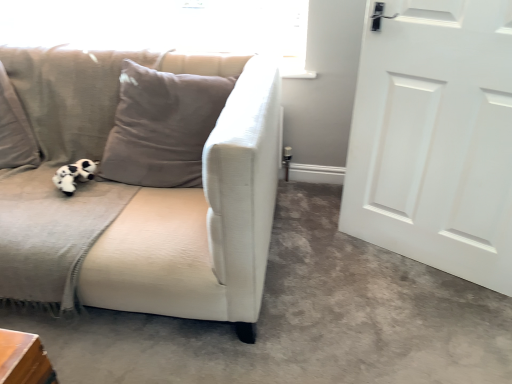
Question: Does white fabric couch at left turn towards transparent glass window screen at upper left?

Choices:
 (A) yes
 (B) no

Answer: (B)

Question: Considering the relative sizes of white fabric couch at left and transparent glass window screen at upper left in the image provided, is white fabric couch at left wider than transparent glass window screen at upper left?

Choices:
 (A) no
 (B) yes

Answer: (B)

Question: Is white fabric couch at left positioned with its back to transparent glass window screen at upper left?

Choices:
 (A) yes
 (B) no

Answer: (B)

Question: Can you confirm if white fabric couch at left is smaller than transparent glass window screen at upper left?

Choices:
 (A) yes
 (B) no

Answer: (B)

Question: Does white fabric couch at left touch transparent glass window screen at upper left?

Choices:
 (A) no
 (B) yes

Answer: (A)

Question: Do you think black plush toy at left is within beige fabric couch at left, or outside of it?

Choices:
 (A) outside
 (B) inside

Answer: (B)

Question: Does point (65, 175) appear closer or farther from the camera than point (112, 183)?

Choices:
 (A) farther
 (B) closer

Answer: (B)

Question: From a real-world perspective, is black plush toy at left positioned above or below beige fabric couch at left?

Choices:
 (A) above
 (B) below

Answer: (B)

Question: Considering their positions, is black plush toy at left located in front of or behind beige fabric couch at left?

Choices:
 (A) behind
 (B) front

Answer: (A)

Question: Looking at the image, does matte gray cushion at center seem bigger or smaller compared to white fabric couch at left?

Choices:
 (A) small
 (B) big

Answer: (B)

Question: Considering their positions, is matte gray cushion at center located in front of or behind white fabric couch at left?

Choices:
 (A) behind
 (B) front

Answer: (A)

Question: From a real-world perspective, is matte gray cushion at center physically located above or below white fabric couch at left?

Choices:
 (A) above
 (B) below

Answer: (A)

Question: Would you say matte gray cushion at center is to the left or to the right of white fabric couch at left in the picture?

Choices:
 (A) left
 (B) right

Answer: (A)

Question: Looking at their shapes, would you say white matte door at right is wider or thinner than transparent glass window screen at upper left?

Choices:
 (A) thin
 (B) wide

Answer: (B)

Question: From a real-world perspective, is white matte door at right physically located above or below transparent glass window screen at upper left?

Choices:
 (A) above
 (B) below

Answer: (B)